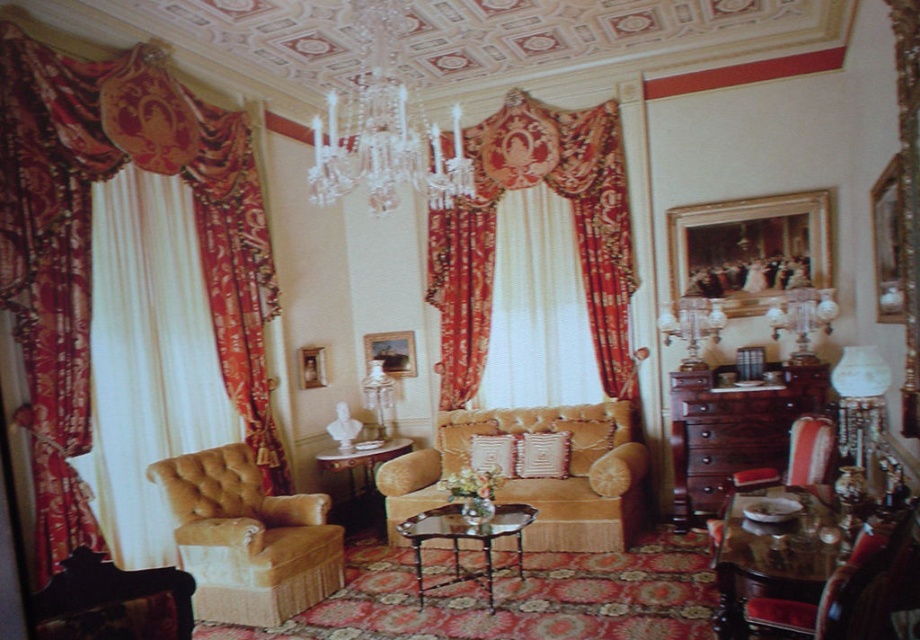
Question: Does velvet drapery at center have a larger size compared to glass/marble coffee table at center?

Choices:
 (A) yes
 (B) no

Answer: (A)

Question: Can you confirm if velvet drapery at center is positioned to the right of velvet gold couch at center?

Choices:
 (A) yes
 (B) no

Answer: (A)

Question: Which object is the closest to the mahogany dresser at center right?

Choices:
 (A) velvet drapery at left
 (B) velvet red armchair at lower right
 (C) velvet gold couch at center

Answer: (C)

Question: Which point appears closest to the camera in this image?

Choices:
 (A) (588, 168)
 (B) (392, 541)
 (C) (331, 150)

Answer: (C)

Question: Is velvet drapery at left wider than velvet gold armchair at lower right?

Choices:
 (A) yes
 (B) no

Answer: (A)

Question: Which point is closer to the camera taking this photo?

Choices:
 (A) (347, 156)
 (B) (720, 444)
 (C) (820, 436)

Answer: (C)